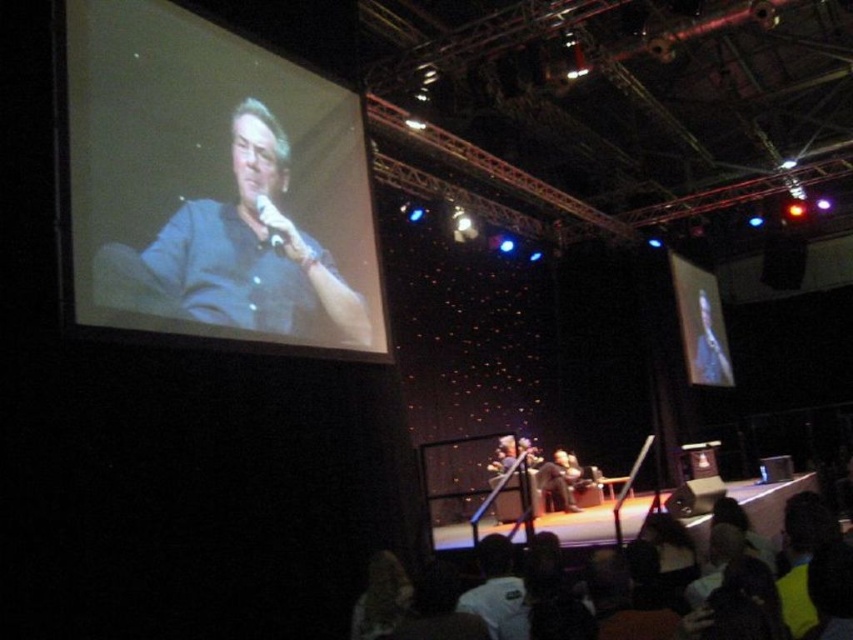
Can you confirm if matte black screen at upper left is shorter than matte black microphone at upper left?

In fact, matte black screen at upper left may be taller than matte black microphone at upper left.

I want to click on matte black screen at upper left, so click(212, 184).

What do you see at coordinates (212, 184) in the screenshot? This screenshot has width=853, height=640. I see `matte black screen at upper left` at bounding box center [212, 184].

I want to click on matte black screen at upper left, so click(212, 184).